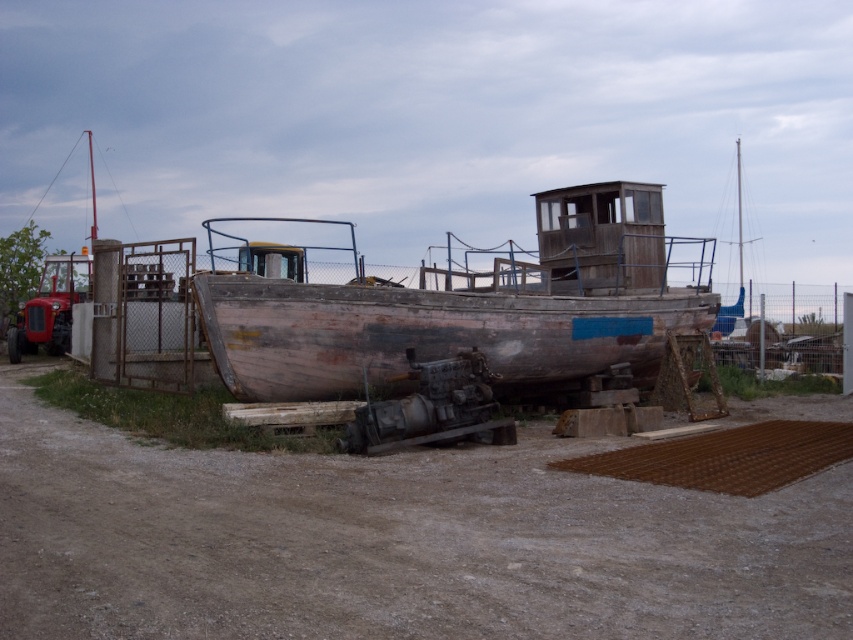
You are driving a small delivery van that is 2.5 meters wide. You come across the brown dirt track at center and the rusty wood boat at center in the image. Can your van safely pass through the track without hitting the boat?

The brown dirt track at center might be wider than rusty wood boat at center, so there is a possibility that the van can pass safely. However, since the exact width difference isn not specified, it is recommended to proceed with caution.

You are a delivery person trying to drive a truck along the brown dirt track at center to reach the rusty wood boat at center. Can you safely navigate the truck to the boat without going off the track?

The brown dirt track at center is positioned on the left side of the rusty wood boat at center, so the truck can safely navigate along the track to reach the boat without going off course.

You are a delivery person trying to reach the rusty wood boat at center. You see the brown dirt track at center leading towards it. Is the track above or below the boat?

The brown dirt track at center is located below the rusty wood boat at center, so the track is below the boat.